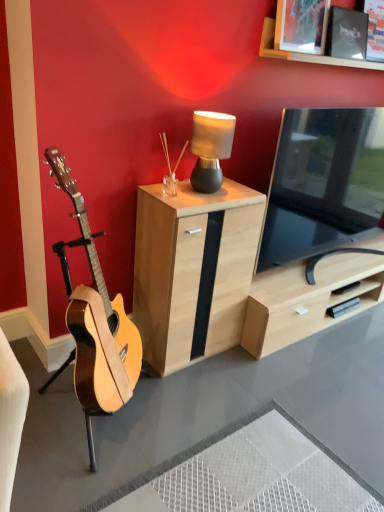
Question: Can you confirm if matte black picture frame at upper right, which appears as the first picture frame when viewed from the right, is shorter than wooden picture frame at upper right, the 2th picture frame positioned from the right?

Choices:
 (A) no
 (B) yes

Answer: (B)

Question: Would you say wooden picture frame at upper right, the 2th picture frame positioned from the right, is part of matte black picture frame at upper right, which appears as the first picture frame when viewed from the right,'s contents?

Choices:
 (A) yes
 (B) no

Answer: (B)

Question: From a real-world perspective, is matte black picture frame at upper right, the second picture frame when ordered from left to right, physically below wooden picture frame at upper right, which ranks as the first picture frame in left-to-right order?

Choices:
 (A) yes
 (B) no

Answer: (A)

Question: Is matte black picture frame at upper right, which appears as the first picture frame when viewed from the right, to the left of wooden picture frame at upper right, the 2th picture frame positioned from the right, from the viewer's perspective?

Choices:
 (A) no
 (B) yes

Answer: (A)

Question: From the image's perspective, is matte black picture frame at upper right, the second picture frame when ordered from left to right, located above wooden picture frame at upper right, which ranks as the first picture frame in left-to-right order?

Choices:
 (A) no
 (B) yes

Answer: (B)

Question: From the image's perspective, is matte black picture frame at upper right, the second picture frame when ordered from left to right, located beneath wooden picture frame at upper right, the 2th picture frame positioned from the right?

Choices:
 (A) no
 (B) yes

Answer: (A)

Question: Is wooden picture frame at upper right, the 2th picture frame positioned from the right, further to the viewer compared to light wood cabinet at center?

Choices:
 (A) yes
 (B) no

Answer: (A)

Question: Is wooden picture frame at upper right, the 2th picture frame positioned from the right, thinner than light wood cabinet at center?

Choices:
 (A) no
 (B) yes

Answer: (B)

Question: Is wooden picture frame at upper right, the 2th picture frame positioned from the right, to the right of light wood cabinet at center from the viewer's perspective?

Choices:
 (A) yes
 (B) no

Answer: (A)

Question: Does wooden picture frame at upper right, the 2th picture frame positioned from the right, lie in front of light wood cabinet at center?

Choices:
 (A) no
 (B) yes

Answer: (A)

Question: Is wooden picture frame at upper right, the 2th picture frame positioned from the right, completely or partially outside of light wood cabinet at center?

Choices:
 (A) yes
 (B) no

Answer: (A)

Question: Is wooden picture frame at upper right, which ranks as the first picture frame in left-to-right order, bigger than light wood cabinet at center?

Choices:
 (A) no
 (B) yes

Answer: (A)

Question: Does natural wood guitar at left appear on the right side of black glossy tv at right?

Choices:
 (A) yes
 (B) no

Answer: (B)